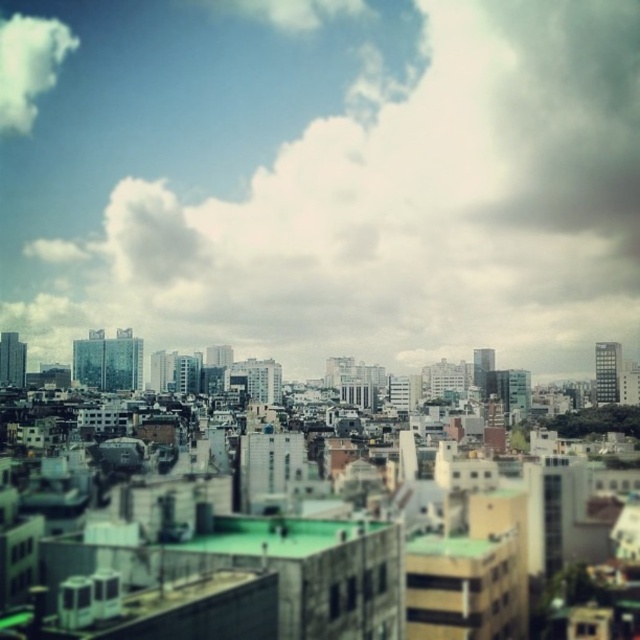
Question: Which point appears farthest from the camera in this image?

Choices:
 (A) pyautogui.click(x=314, y=68)
 (B) pyautogui.click(x=60, y=54)

Answer: (B)

Question: Among these objects, which one is farthest from the camera?

Choices:
 (A) white fluffy cloud at upper left
 (B) white fluffy cloud at upper center

Answer: (A)

Question: Is white fluffy cloud at upper center behind white fluffy cloud at upper left?

Choices:
 (A) no
 (B) yes

Answer: (A)

Question: Is white fluffy cloud at upper center above white fluffy cloud at upper left?

Choices:
 (A) yes
 (B) no

Answer: (B)

Question: Does white fluffy cloud at upper center have a lesser width compared to white fluffy cloud at upper left?

Choices:
 (A) yes
 (B) no

Answer: (B)